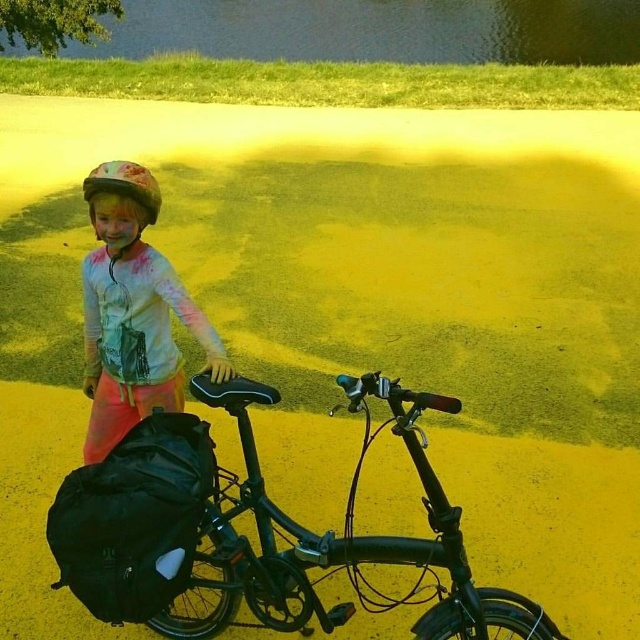
Question: Is shiny black bicycle at center smaller than white matte shirt at upper left?

Choices:
 (A) yes
 (B) no

Answer: (B)

Question: Which object is farther from the camera taking this photo?

Choices:
 (A) white matte shirt at upper left
 (B) shiny black bicycle at center

Answer: (A)

Question: Which of the following is the closest to the observer?

Choices:
 (A) matte white helmet at center
 (B) shiny black bicycle at center

Answer: (B)

Question: Which object is farther from the camera taking this photo?

Choices:
 (A) shiny black bicycle at center
 (B) matte white helmet at center

Answer: (B)

Question: Is shiny black bicycle at center further to the viewer compared to matte white helmet at center?

Choices:
 (A) no
 (B) yes

Answer: (A)

Question: Does shiny black bicycle at center appear under white matte shirt at upper left?

Choices:
 (A) no
 (B) yes

Answer: (B)